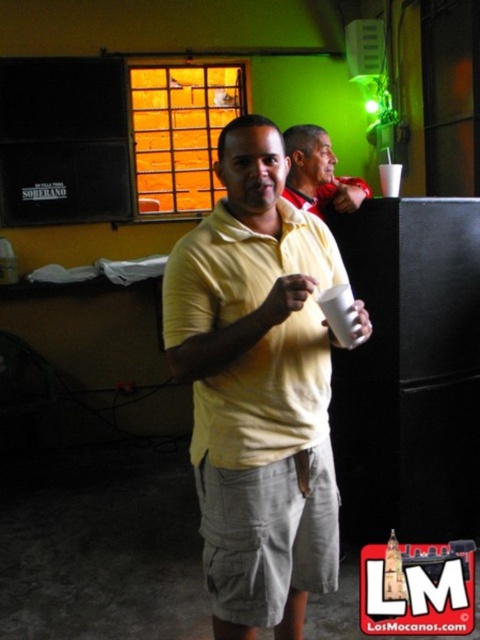
Question: Is yellow cotton shirt at center wider than yellow matte shirt at center?

Choices:
 (A) yes
 (B) no

Answer: (A)

Question: Does yellow cotton shirt at center appear on the left side of yellow matte shirt at center?

Choices:
 (A) no
 (B) yes

Answer: (B)

Question: Which point is closer to the camera?

Choices:
 (A) (316, 128)
 (B) (276, 460)

Answer: (B)

Question: Is yellow cotton shirt at center wider than yellow matte shirt at center?

Choices:
 (A) yes
 (B) no

Answer: (A)